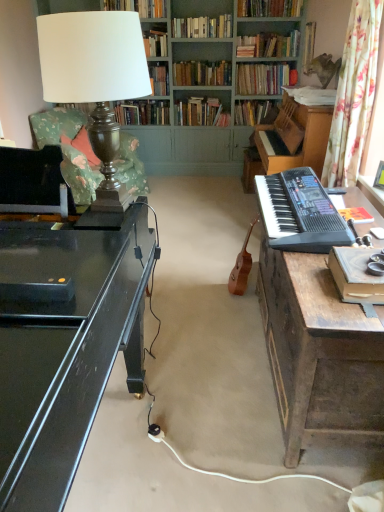
The image size is (384, 512). I want to click on vacant position to the left of wooden desk at right, so click(x=207, y=360).